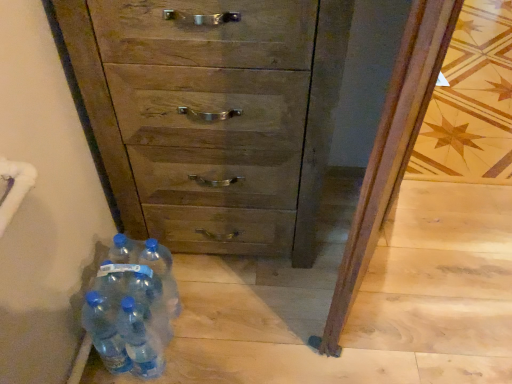
This screenshot has height=384, width=512. In order to click on vacant space to the right of transparent plastic bottles at lower left, arranged as the third bottle when viewed from the left in this screenshot , I will do `click(207, 355)`.